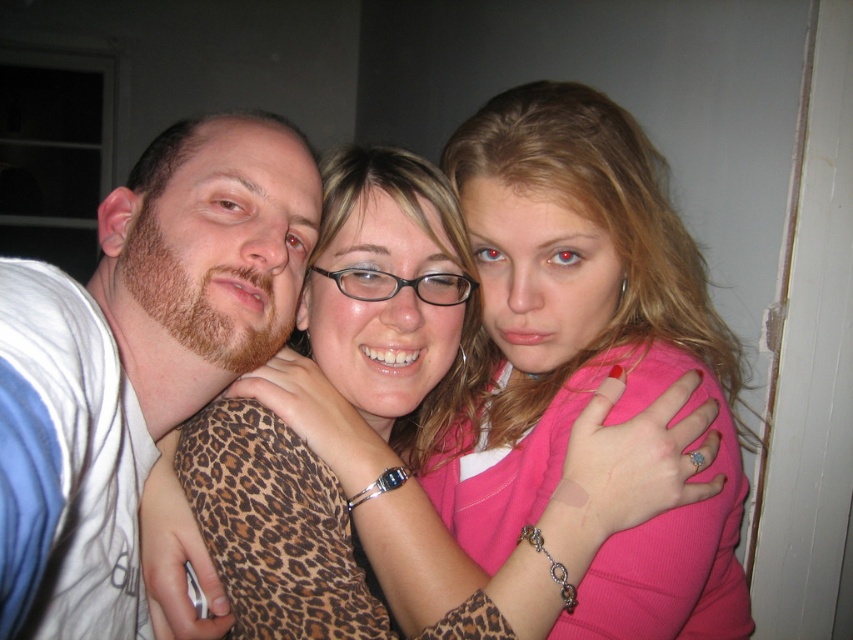
Which is in front, point (357, 618) or point (158, 323)?

Point (158, 323) is in front.

Between leopard print top at center and matte white t-shirt at left, which one appears on the right side from the viewer's perspective?

leopard print top at center is more to the right.

Image resolution: width=853 pixels, height=640 pixels. What do you see at coordinates (335, 397) in the screenshot?
I see `leopard print top at center` at bounding box center [335, 397].

Locate an element on the screen. The image size is (853, 640). leopard print top at center is located at coordinates (335, 397).